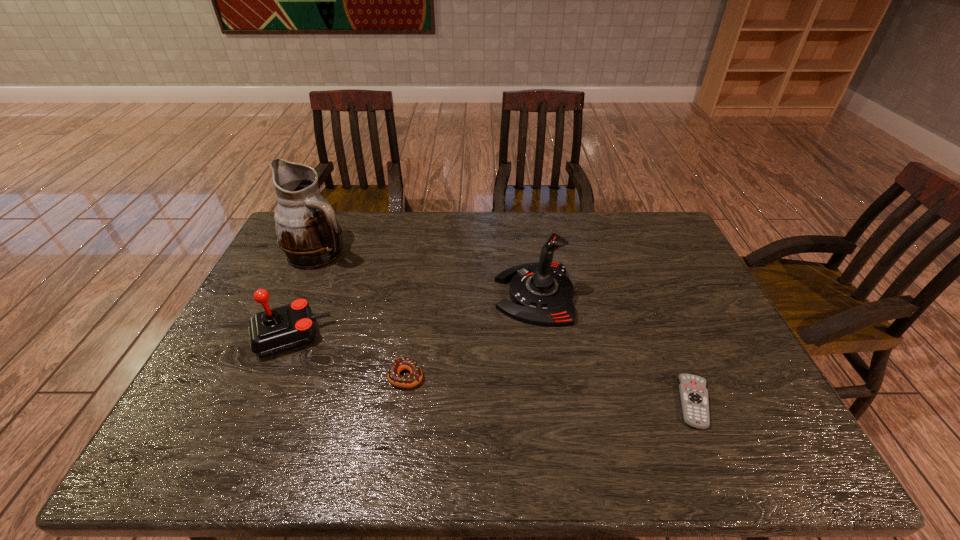
The height and width of the screenshot is (540, 960). Identify the location of free space that satisfies the following two spatial constraints: 1. on the back side of the shorter joystick; 2. from the spout of the tallest object. (325, 253).

Locate an element on the screen. vacant space that satisfies the following two spatial constraints: 1. on the front side of the second shortest object; 2. on the left side of the shorter joystick is located at coordinates (273, 376).

You are a GUI agent. You are given a task and a screenshot of the screen. Output one action in this format:
    pyautogui.click(x=<x>, y=<y>)
    Task: Click on the blank space that satisfies the following two spatial constraints: 1. on the back side of the remote control; 2. from the spout of the tallest object
    
    Given the screenshot: What is the action you would take?
    pyautogui.click(x=632, y=253)

The image size is (960, 540). Find the location of `free space that satisfies the following two spatial constraints: 1. on the handle side of the right joystick; 2. on the left side of the rightmost object`. free space that satisfies the following two spatial constraints: 1. on the handle side of the right joystick; 2. on the left side of the rightmost object is located at coordinates (550, 402).

Locate an element on the screen. free space that satisfies the following two spatial constraints: 1. on the handle side of the fourth object from left to right; 2. on the right side of the shortest object is located at coordinates (550, 402).

At what (x,y) coordinates should I click in order to perform the action: click on free space that satisfies the following two spatial constraints: 1. from the spout of the fourth tallest object; 2. on the left side of the tallest object. Please return your answer as a coordinate pair (x, y). The width and height of the screenshot is (960, 540). Looking at the image, I should click on (265, 376).

Find the location of a particular element. The image size is (960, 540). free space that satisfies the following two spatial constraints: 1. from the spout of the pitcher; 2. on the back side of the doughnut is located at coordinates (265, 376).